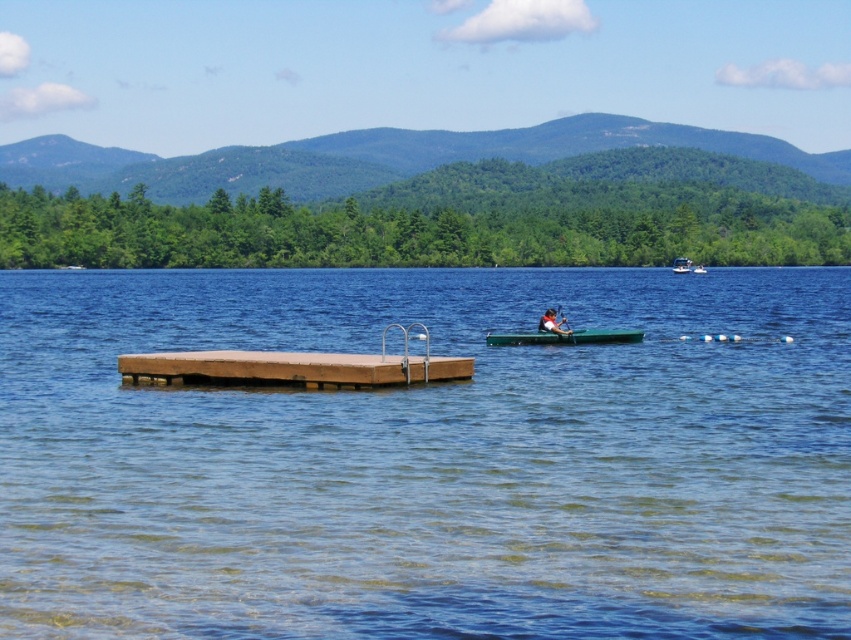
You are standing on the wooden dock and want to check if the matte black canoe at center is submerged in the clear water at center. Based on their positions, can you determine if the canoe is floating on the water or resting on the lakebed?

The clear water at center is closer to the viewer than the matte black canoe at center. This means the canoe is positioned behind the water from your perspective, so it is likely floating on the surface rather than resting on the lakebed.